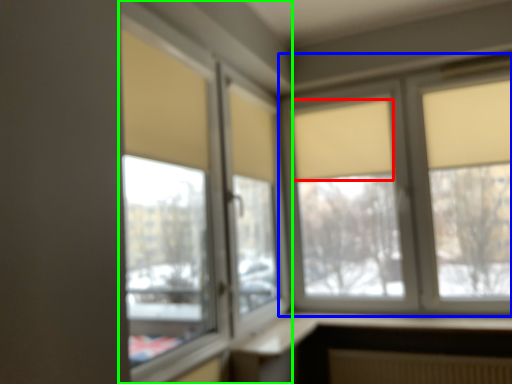
Question: Which object is positioned closest to curtain (highlighted by a red box)? Select from window (highlighted by a blue box) and window (highlighted by a green box).

Choices:
 (A) window
 (B) window

Answer: (A)